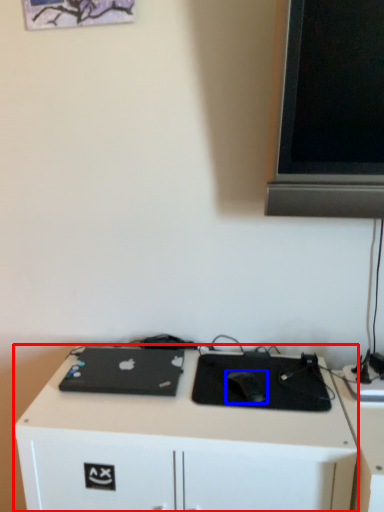
Question: Which of the following is the closest to the observer, desk (highlighted by a red box) or mouse (highlighted by a blue box)?

Choices:
 (A) desk
 (B) mouse

Answer: (A)